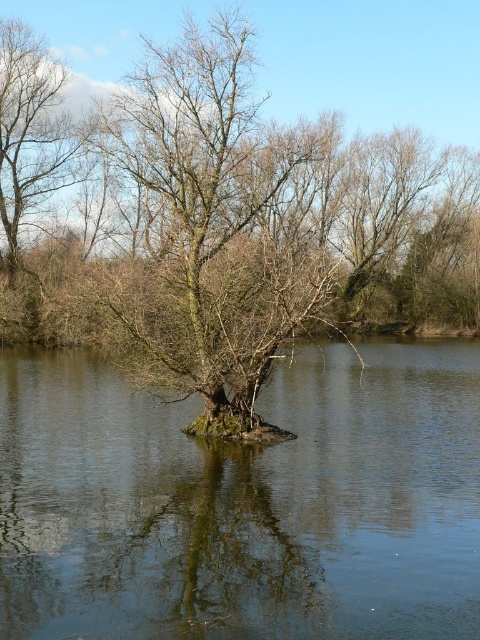
You are standing on a wooden bridge that crosses over the greenish reflective water at center. You want to take a photo of the green leafy tree at center without any obstructions. Is the tree visible in your current position?

The green leafy tree at center is further to the viewer than the greenish reflective water at center, so yes, the tree is visible from your position on the wooden bridge as it is closer to you than the water.